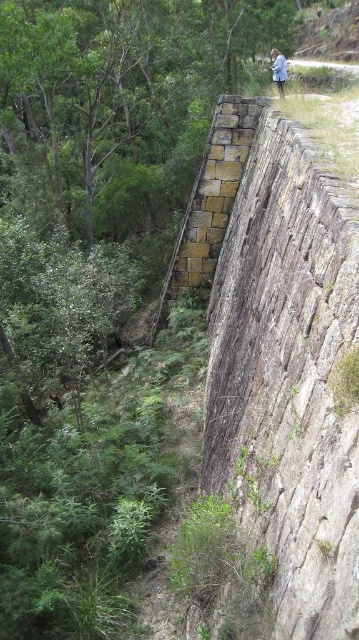
Question: Which of the following is the farthest from the observer?

Choices:
 (A) (258, 483)
 (B) (276, 83)

Answer: (B)

Question: Is brown stone wall at center closer to camera compared to green leafy tree at upper left?

Choices:
 (A) yes
 (B) no

Answer: (A)

Question: Estimate the real-world distances between objects in this image. Which object is closer to the blue cotton shirt at upper center?

Choices:
 (A) green leafy tree at upper left
 (B) brown stone wall at center

Answer: (A)

Question: Among these points, which one is farthest from the camera?

Choices:
 (A) (277, 77)
 (B) (75, 227)

Answer: (B)

Question: Is green leafy tree at upper left bigger than blue cotton shirt at upper center?

Choices:
 (A) no
 (B) yes

Answer: (B)

Question: Can you confirm if green leafy tree at upper left is smaller than blue cotton shirt at upper center?

Choices:
 (A) no
 (B) yes

Answer: (A)